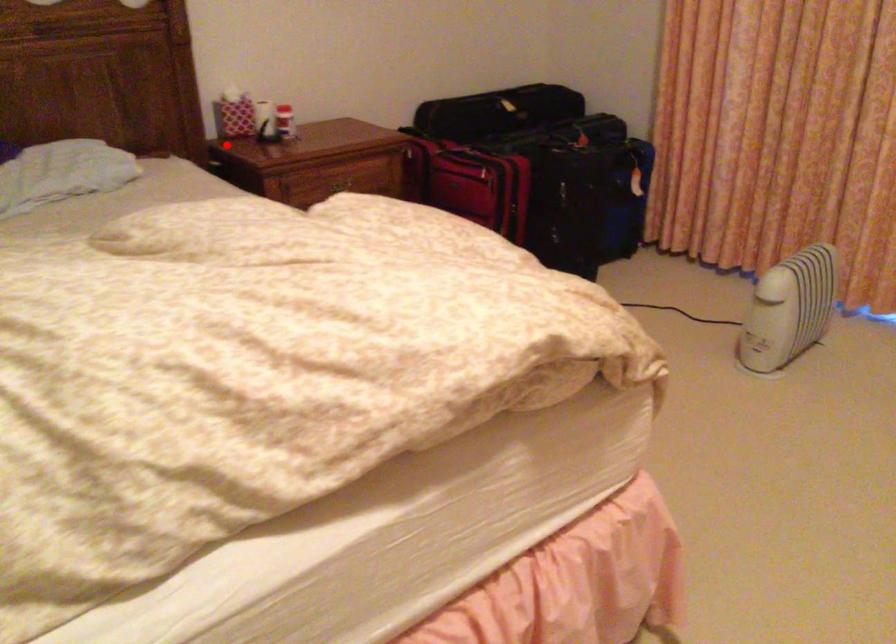
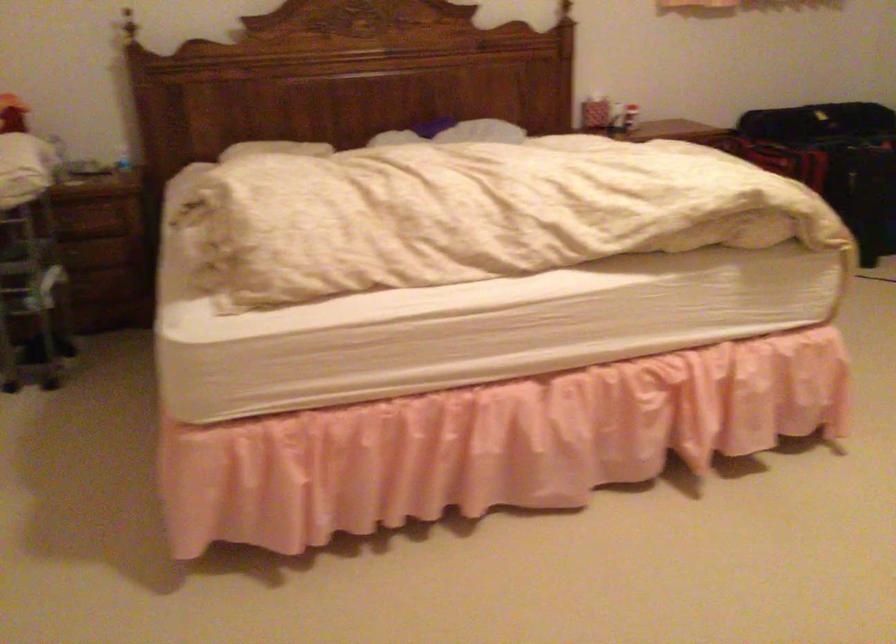
Question: I am providing you with two images of the same scene from different viewpoints. In image1, a red point is highlighted. Considering the same 3D point in image2, which of the following is correct?

Choices:
 (A) It is closer
 (B) It is farther

Answer: (B)